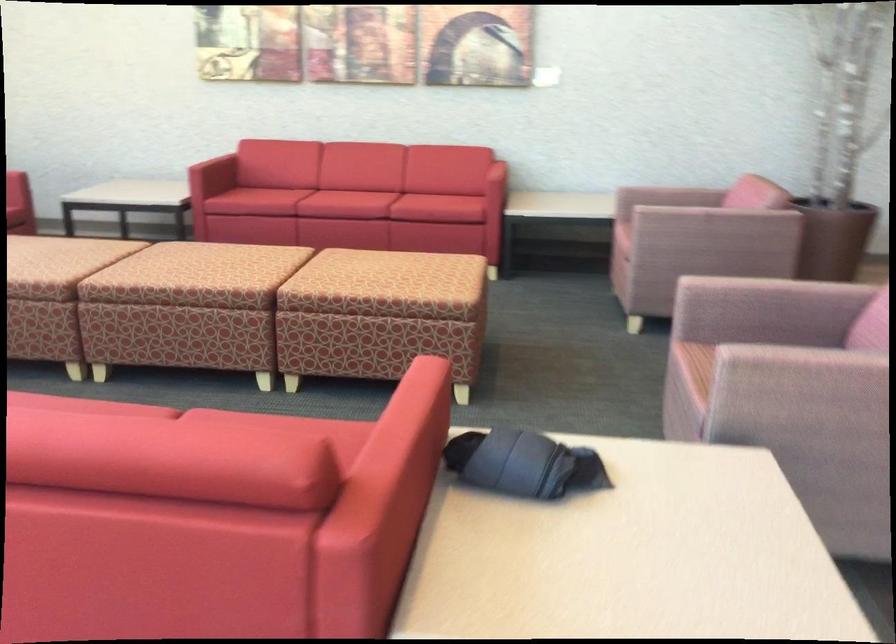
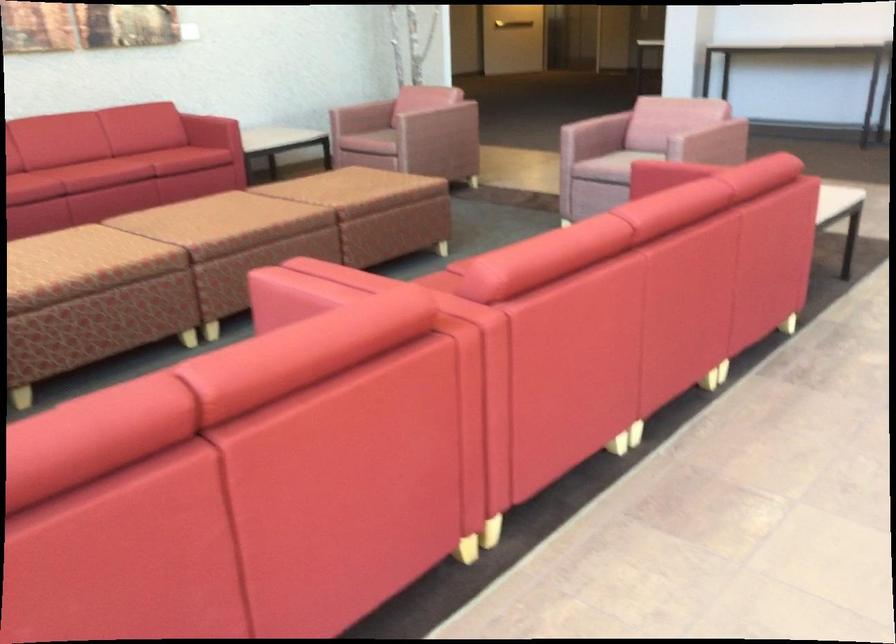
Question: I am providing you with two images of the same scene from different viewpoints. Please identify which objects are invisible in image2.

Choices:
 (A) rolled up clothing
 (B) small black button
 (C) horizontal door handle
 (D) red sofa armrest

Answer: (A)